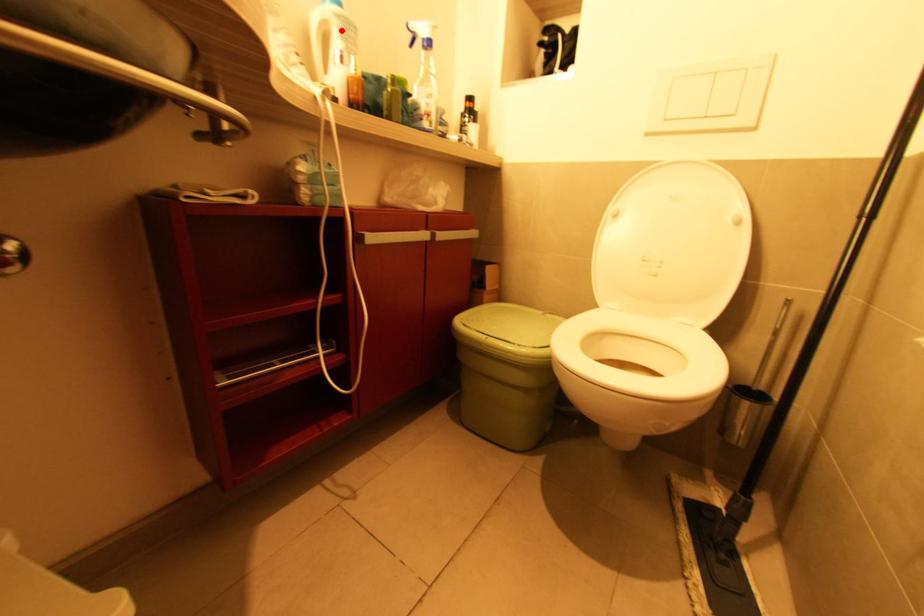
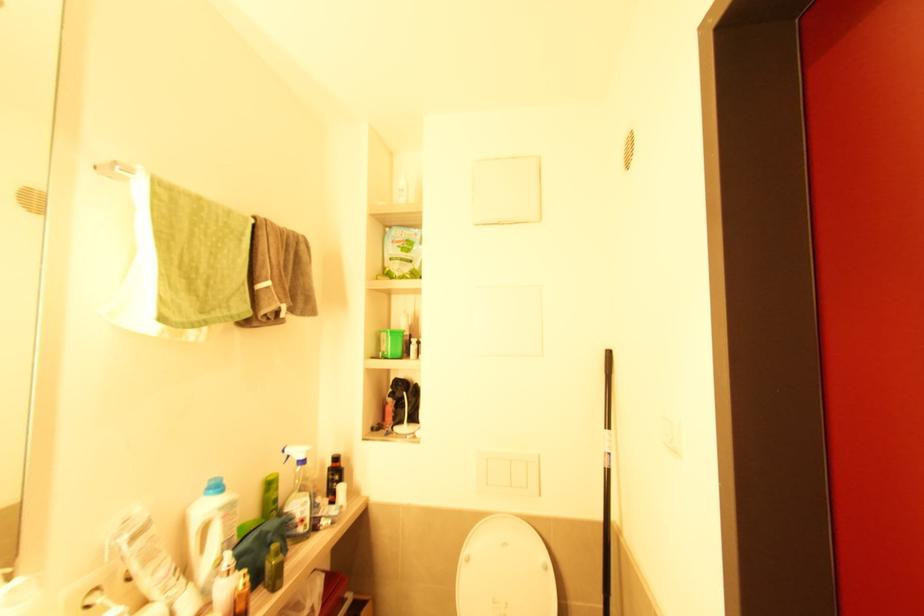
Locate, in the second image, the point that corresponds to the highlighted location in the first image.

(224, 519)